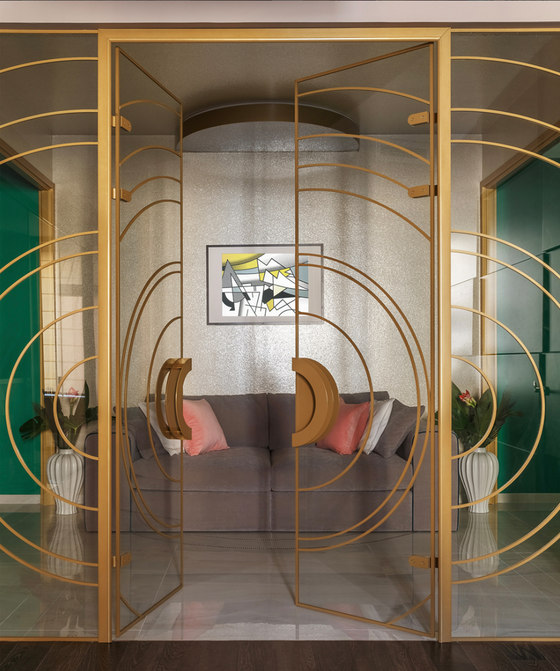
Identify the location of office sofa. (238, 484), (286, 478).